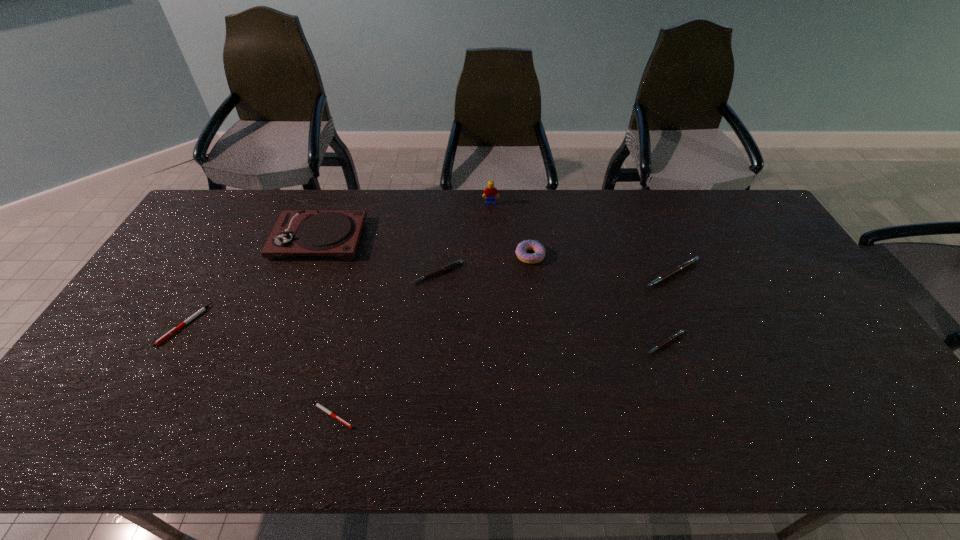
Identify the location of empty space between the nearest pink pen and the biggest pink pen. The height and width of the screenshot is (540, 960). tap(668, 308).

What are the coordinates of `object that can be found as the third closest to the phonograph_record` in the screenshot? It's located at (490, 192).

Choose which object is the second nearest neighbor to the nearest object. Please provide its 2D coordinates. Your answer should be formatted as a tuple, i.e. [(x, y)], where the tuple contains the x and y coordinates of a point satisfying the conditions above.

[(168, 334)]

You are a GUI agent. You are given a task and a screenshot of the screen. Output one action in this format:
    pyautogui.click(x=<x>, y=<y>)
    Task: Click on the pen that is the third nearest to the nearer white pen
    The height and width of the screenshot is (540, 960).
    Given the screenshot: What is the action you would take?
    pyautogui.click(x=669, y=339)

The height and width of the screenshot is (540, 960). Find the location of `the fourth closest pen to the fifth shortest object`. the fourth closest pen to the fifth shortest object is located at coordinates (168, 334).

Locate which pink pen is the closest to the third object from right to left. Please provide its 2D coordinates. Your answer should be formatted as a tuple, i.e. [(x, y)], where the tuple contains the x and y coordinates of a point satisfying the conditions above.

[(454, 264)]

Locate which pink pen ranks in proximity to the farther white pen. Please provide its 2D coordinates. Your answer should be formatted as a tuple, i.e. [(x, y)], where the tuple contains the x and y coordinates of a point satisfying the conditions above.

[(454, 264)]

Locate an element on the screen. vacant space that satisfies the following two spatial constraints: 1. on the face of the tallest object; 2. on the right side of the doughnut is located at coordinates [x=492, y=255].

Identify the location of vacant space that satisfies the following two spatial constraints: 1. on the face of the fourth object from right to left; 2. on the right side of the doughnut. (492, 255).